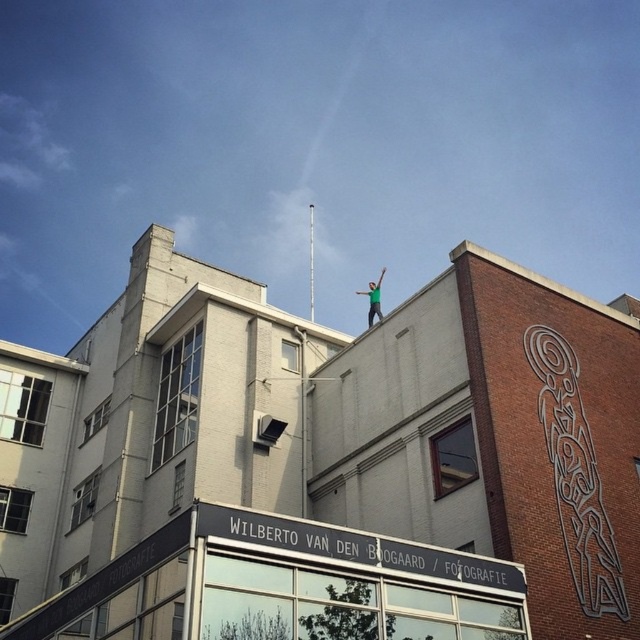
You are a city planner assessing the building for safety. The white glossy pole at upper center and the green fabric person at upper center are both on the building. Which object is taller?

The white glossy pole at upper center is taller than the green fabric person at upper center according to the description.

You are standing at the point marked as point (310, 260) in the urban scene. What object is located exactly at that point?

The white glossy pole at upper center is located exactly at point (310, 260).